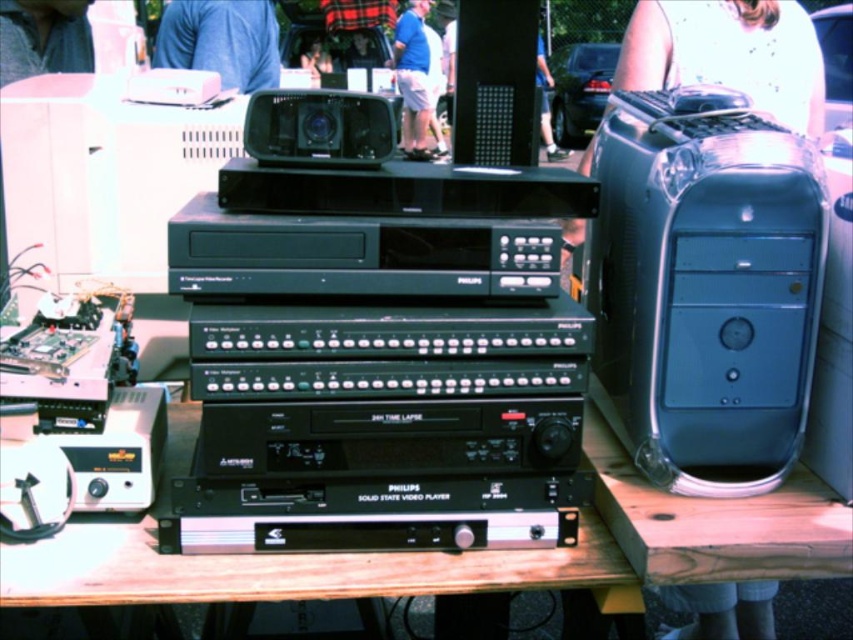
You are setting up a temporary audio station at the flea market and need to place the black matte speaker at upper center and the black plastic radio at center on a shelf that can only hold items narrower than 30 cm. According to the scene description, can both items fit on the shelf?

The black matte speaker at upper center has a lesser width compared to the black plastic radio at center. Since the shelf requires items narrower than 30 cm, we need to confirm the width of the wider item, the black plastic radio at center. However, the description only states the relative width between them but does not provide exact measurements. Without knowing the exact width of the black plastic radio at center, it is impossible to determine if both items will fit on the shelf.

You are setting up a display at a flea market and need to place the satin silver computer tower at right and the black plastic radio at center on a shelf. The shelf has limited space. Based on the scene description, which object requires more space?

The satin silver computer tower at right requires more space because it is bigger than the black plastic radio at center.